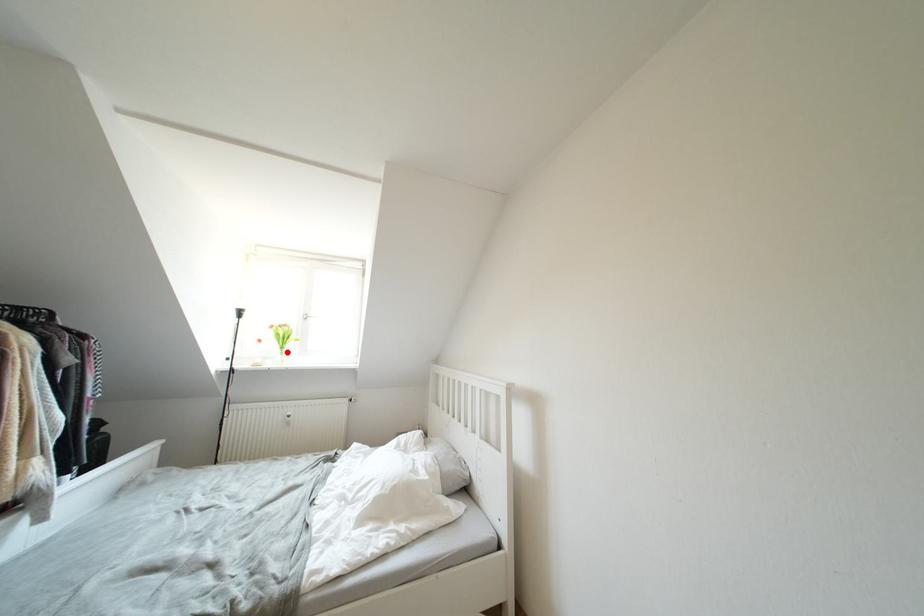
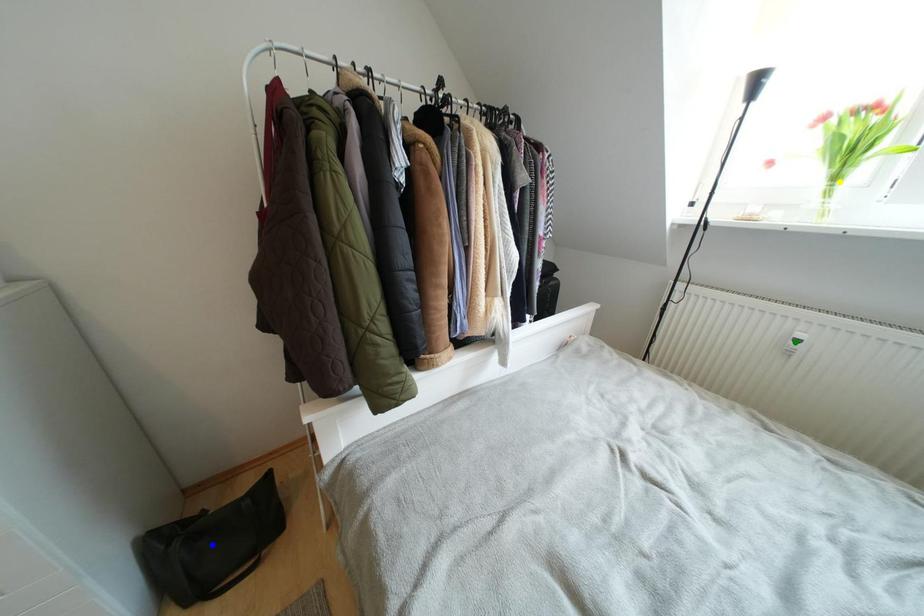
Question: I am providing you with two images of the same scene from different viewpoints. A red point is marked on the first image. You are given multiple points on the second image. Which mark in image 2 goes with the point in image 1?

Choices:
 (A) yellow point
 (B) blue point
 (C) green point

Answer: (A)